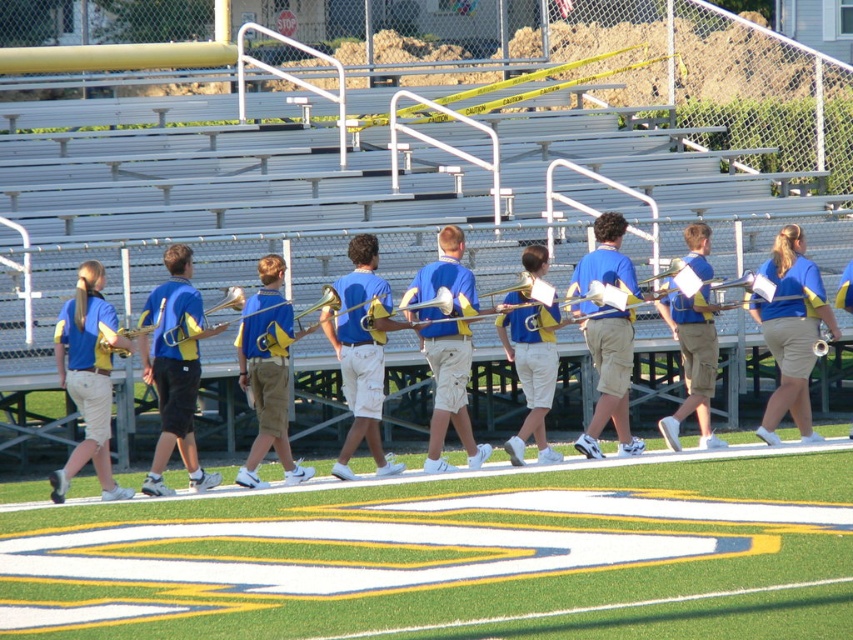
You are a photographer trying to capture a photo of the matte blue shirt at left and the white synthetic turf at center. Based on their positions, which object should you focus on first if you want to include both in your frame?

The matte blue shirt at left should be focused on first because it is positioned to the left of the white synthetic turf at center, allowing you to frame them from left to right.